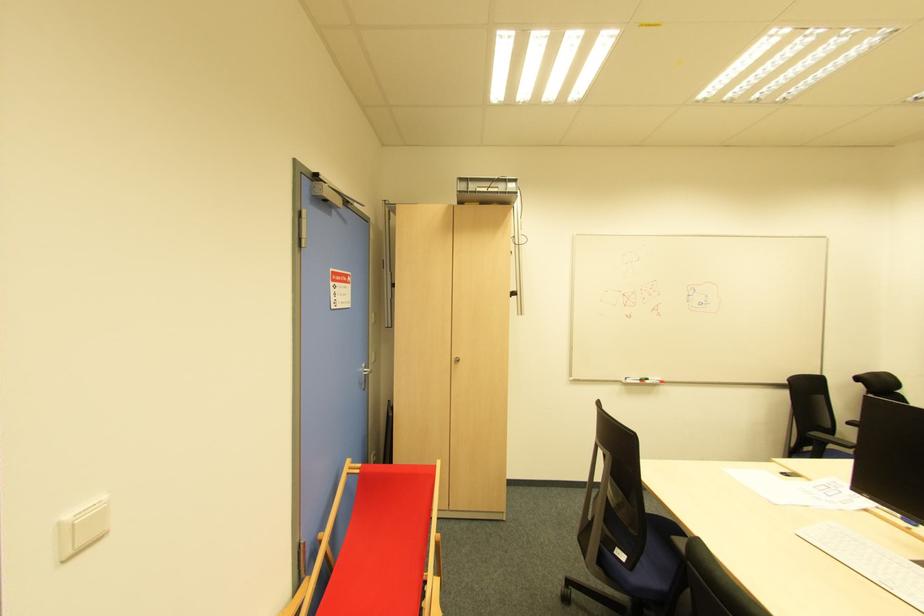
Find the location of a particular element. This screenshot has height=616, width=924. red whiteboard marker is located at coordinates (652, 381).